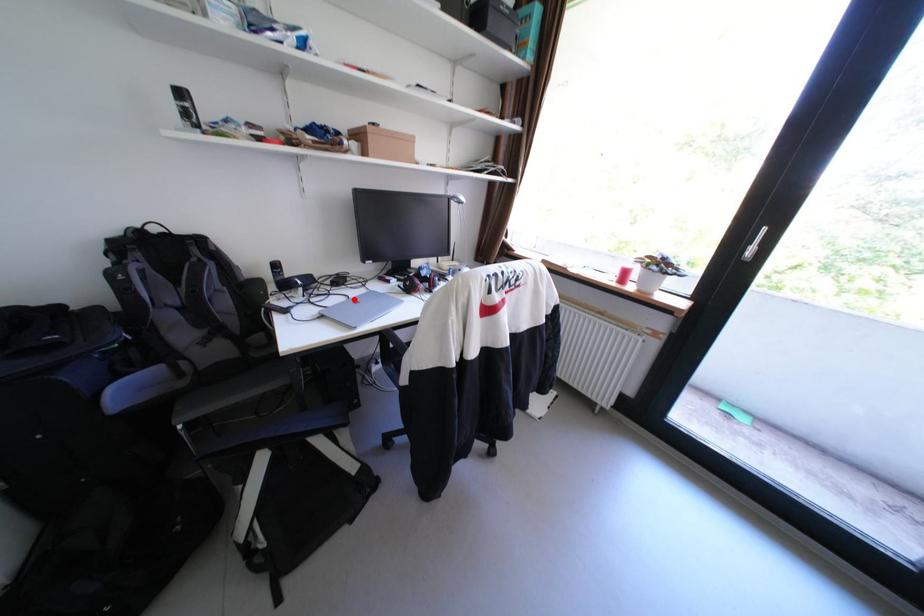
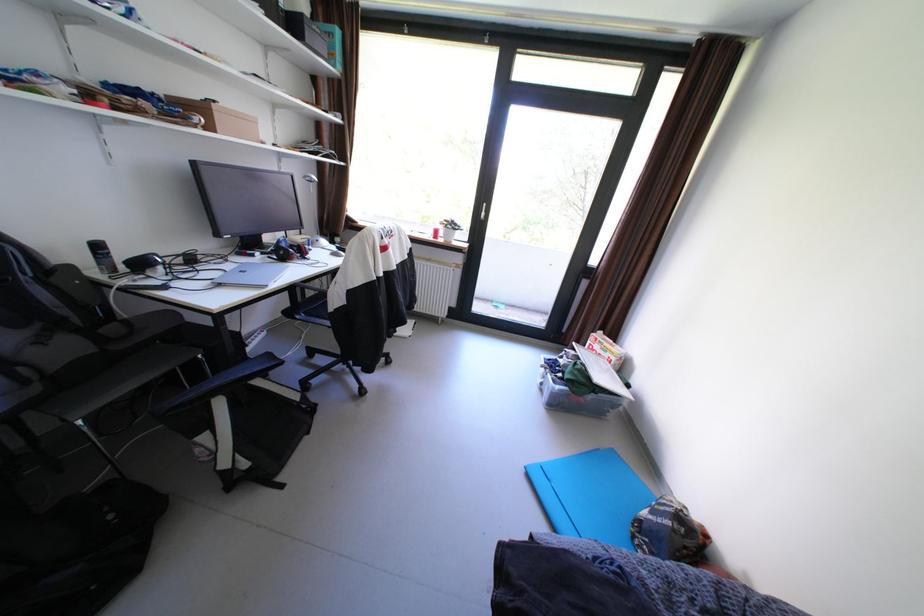
Question: I am providing you with two images of the same scene from different viewpoints. A red point is marked on the first image. At the location where the point appears in image 1, is it still visible in image 2?

Choices:
 (A) Yes
 (B) No

Answer: (A)